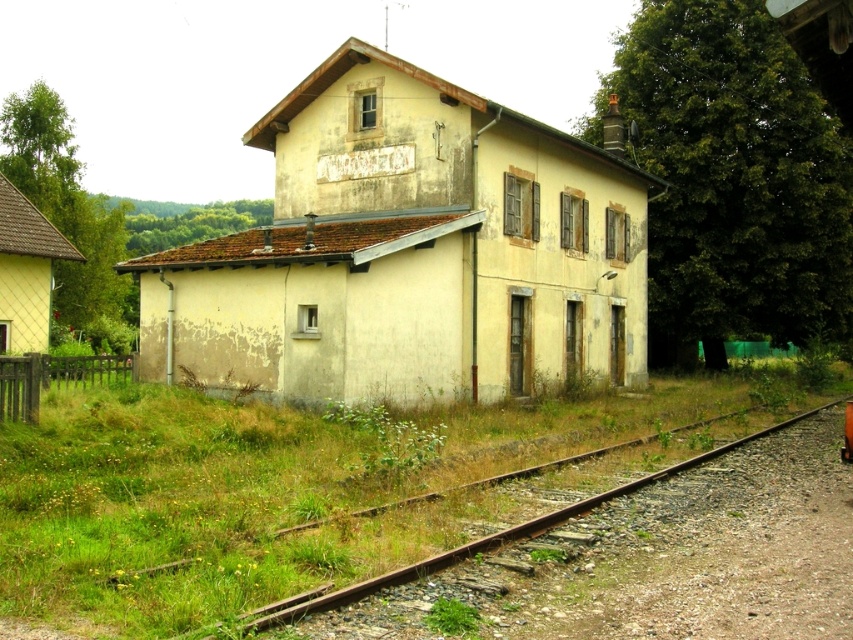
Who is more forward, [766,634] or [848,426]?

Point [766,634] is more forward.

Is rusty metal train track at lower right above orange matte train at lower right?

Actually, rusty metal train track at lower right is below orange matte train at lower right.

Who is more forward, (514, 608) or (843, 449)?

Point (514, 608) is more forward.

Locate an element on the screen. This screenshot has height=640, width=853. rusty metal train track at lower right is located at coordinates 643,557.